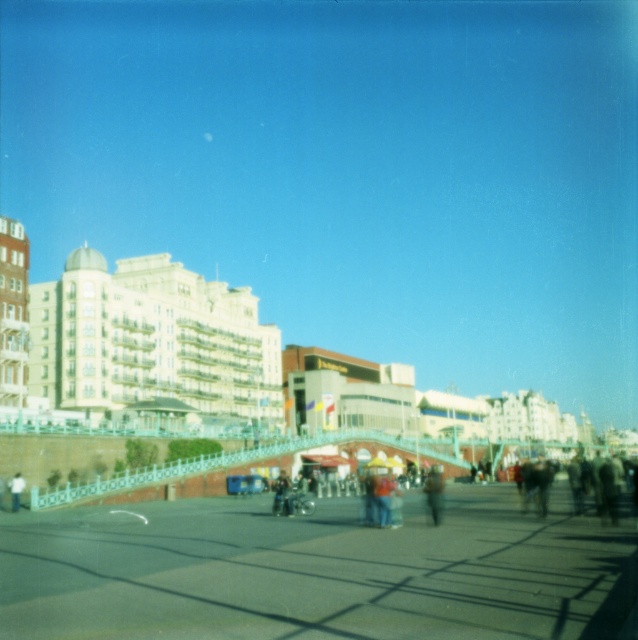
You are standing on the teal painted metal pedestrian bridge at center and want to find the brown fuzzy coat at center. Which direction should you look to locate it?

The brown fuzzy coat at center is to the left of the teal painted metal pedestrian bridge at center, so you should look to your left to locate it.

You are a photographer standing on the pedestrian walkway. You want to take a photo of both the dark blue jeans at center and the dark gray concrete person at center. Which object should you zoom in on to ensure both fit in the frame?

You should zoom in on the dark gray concrete person at center because it is smaller than the dark blue jeans at center, allowing both to fit within the frame when zoomed in appropriately.